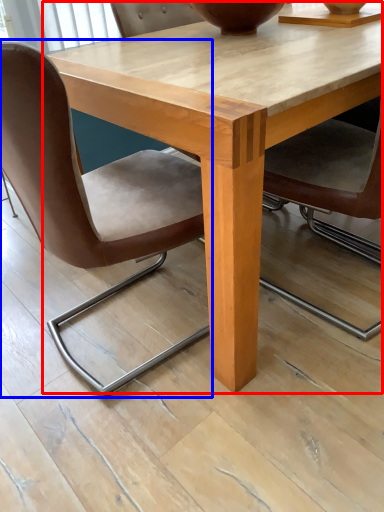
Question: Which of the following is the farthest to the observer, coffee table (highlighted by a red box) or chair (highlighted by a blue box)?

Choices:
 (A) coffee table
 (B) chair

Answer: (A)